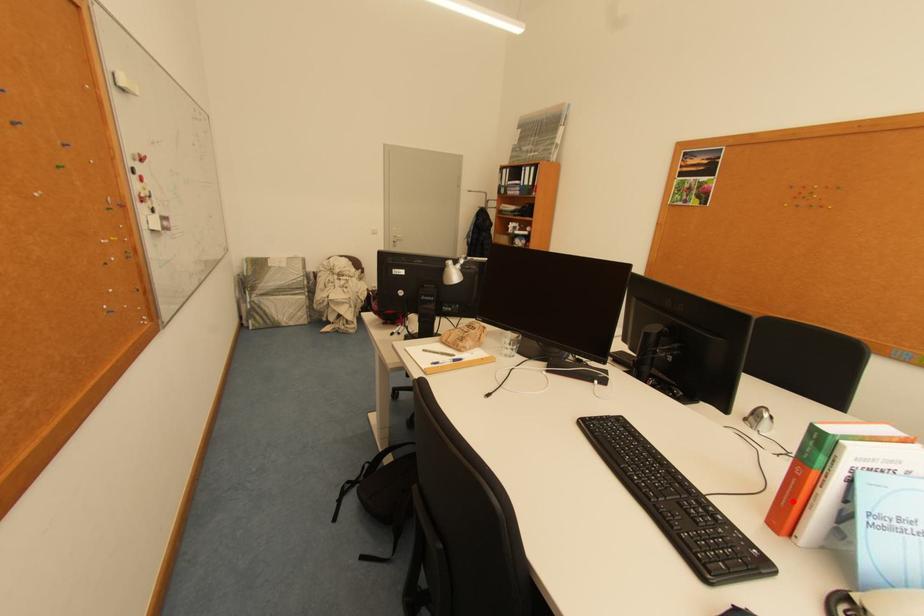
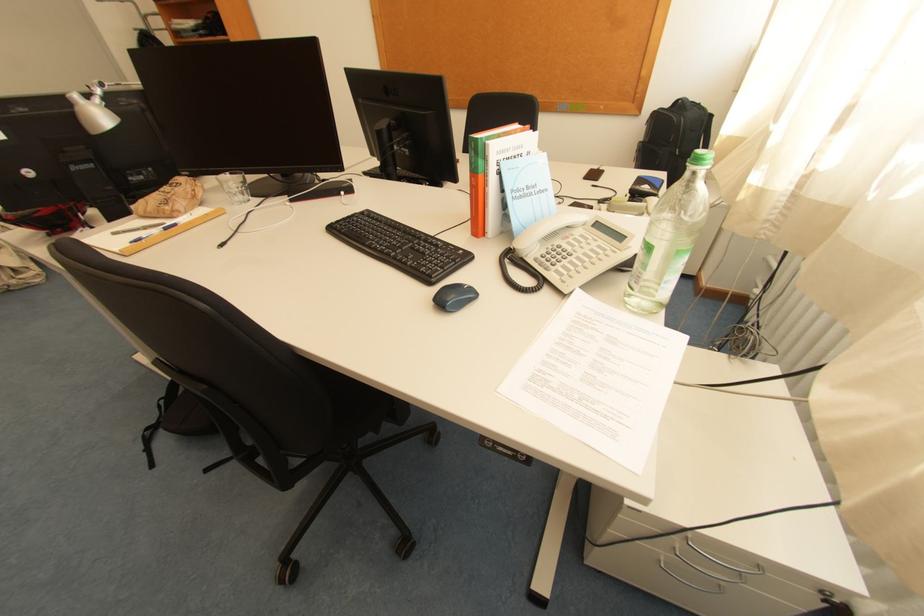
In the second image, find the point that corresponds to the highlighted location in the first image.

(482, 211)